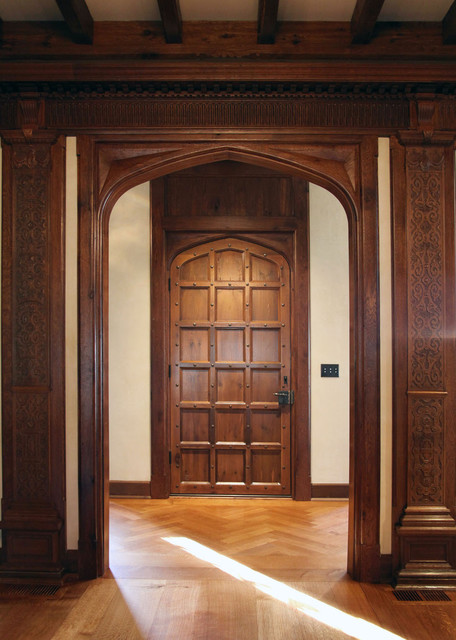
The image size is (456, 640). In order to click on wood floor in this screenshot , I will do `click(301, 513)`, `click(96, 625)`.